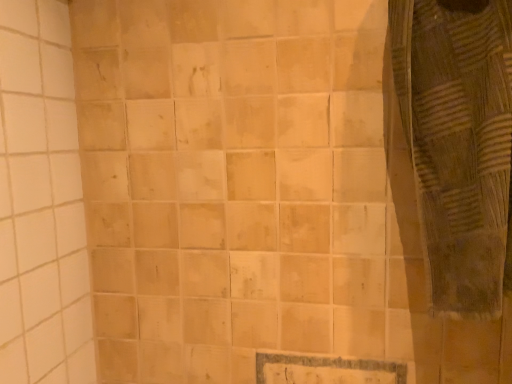
Find the location of a particular element. This screenshot has height=384, width=512. brown woven fabric at right is located at coordinates (456, 178).

The width and height of the screenshot is (512, 384). What do you see at coordinates (456, 178) in the screenshot? I see `brown woven fabric at right` at bounding box center [456, 178].

Locate an element on the screen. Image resolution: width=512 pixels, height=384 pixels. brown woven fabric at right is located at coordinates (456, 178).